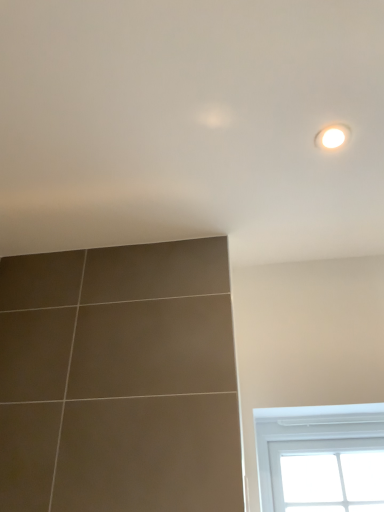
What are the coordinates of `white glossy light fixture at upper right` in the screenshot? It's located at (332, 136).

The height and width of the screenshot is (512, 384). What do you see at coordinates (332, 136) in the screenshot? I see `white glossy light fixture at upper right` at bounding box center [332, 136].

Image resolution: width=384 pixels, height=512 pixels. I want to click on white glossy light fixture at upper right, so click(x=332, y=136).